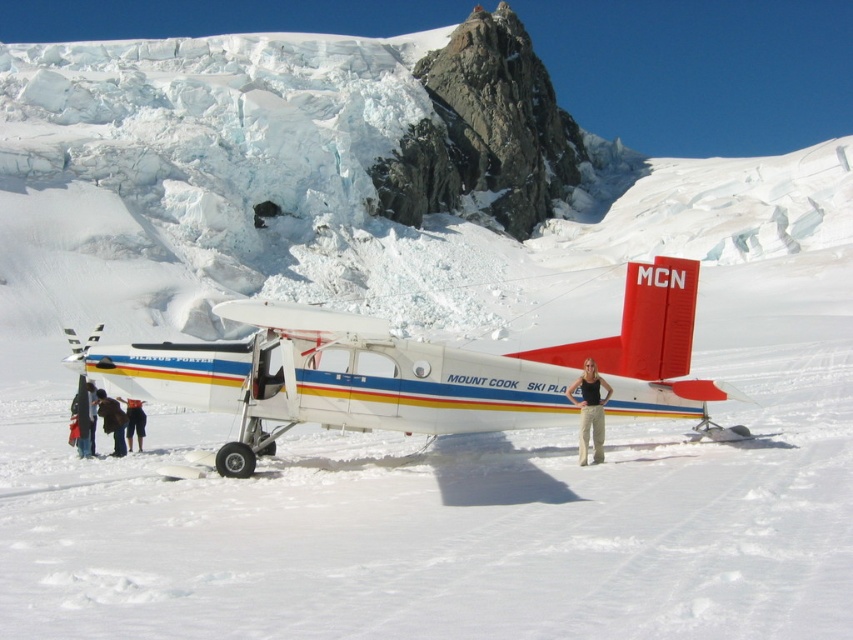
Is point (660, 356) farther from viewer compared to point (90, 387)?

No, (660, 356) is in front of (90, 387).

Who is positioned more to the right, white matte airplane at center or dark blue jacket at lower left?

Positioned to the right is white matte airplane at center.

At what (x,y) coordinates should I click in order to perform the action: click on white matte airplane at center. Please return your answer as a coordinate pair (x, y). Looking at the image, I should click on (413, 371).

Identify the location of white matte airplane at center. The height and width of the screenshot is (640, 853). (413, 371).

Does white matte airplane at center appear over dark brown leather jacket at lower left?

Correct, white matte airplane at center is located above dark brown leather jacket at lower left.

Is white matte airplane at center smaller than dark brown leather jacket at lower left?

Incorrect, white matte airplane at center is not smaller in size than dark brown leather jacket at lower left.

Does point (149, 380) come farther from viewer compared to point (115, 433)?

No.

Where is `white matte airplane at center`? The height and width of the screenshot is (640, 853). white matte airplane at center is located at coordinates (413, 371).

Is tan pants at center to the right of dark blue jeans at lower left from the viewer's perspective?

Correct, you'll find tan pants at center to the right of dark blue jeans at lower left.

Is tan pants at center positioned behind dark blue jeans at lower left?

That is False.

Who is more forward, (589, 436) or (129, 404)?

Point (589, 436) is more forward.

Locate an element on the screen. The width and height of the screenshot is (853, 640). tan pants at center is located at coordinates (590, 410).